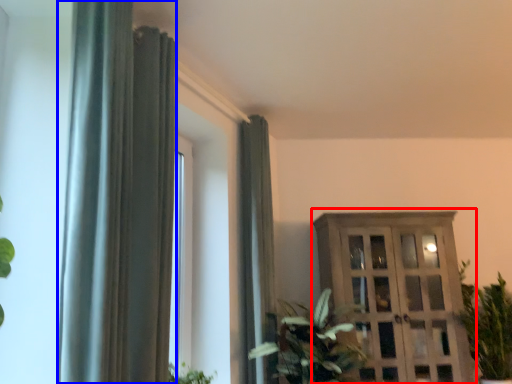
Question: Which object is closer to the camera taking this photo, dresser (highlighted by a red box) or curtain (highlighted by a blue box)?

Choices:
 (A) dresser
 (B) curtain

Answer: (B)